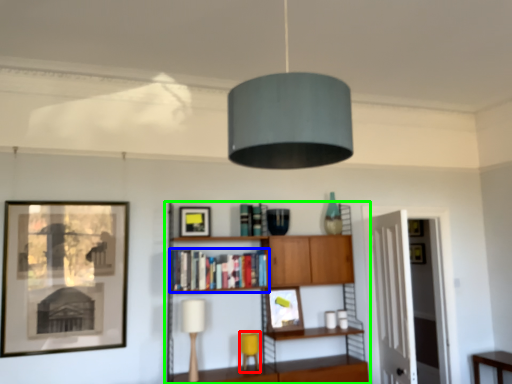
Question: Which is nearer to the table lamp (highlighted by a red box)? book (highlighted by a blue box) or shelf (highlighted by a green box).

Choices:
 (A) book
 (B) shelf

Answer: (B)